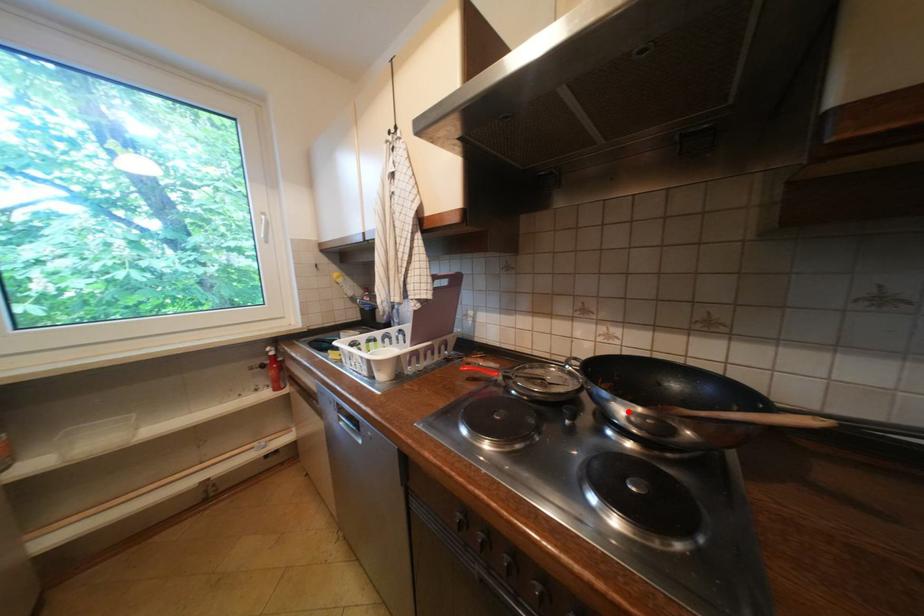
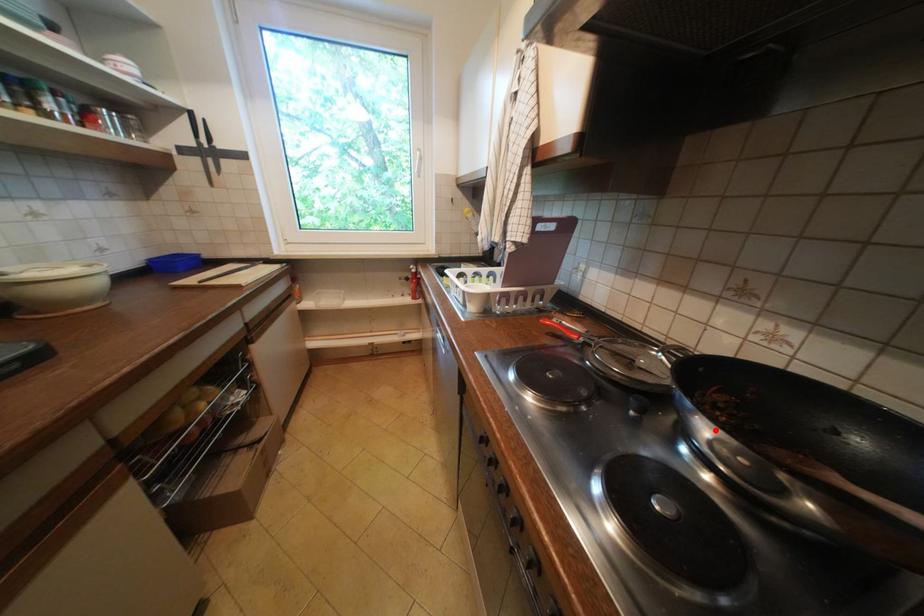
I am providing you with two images of the same scene from different viewpoints. A red point is marked on the first image and another point is marked on the second image. Are the points marked in image1 and image2 representing the same 3D position?

Yes